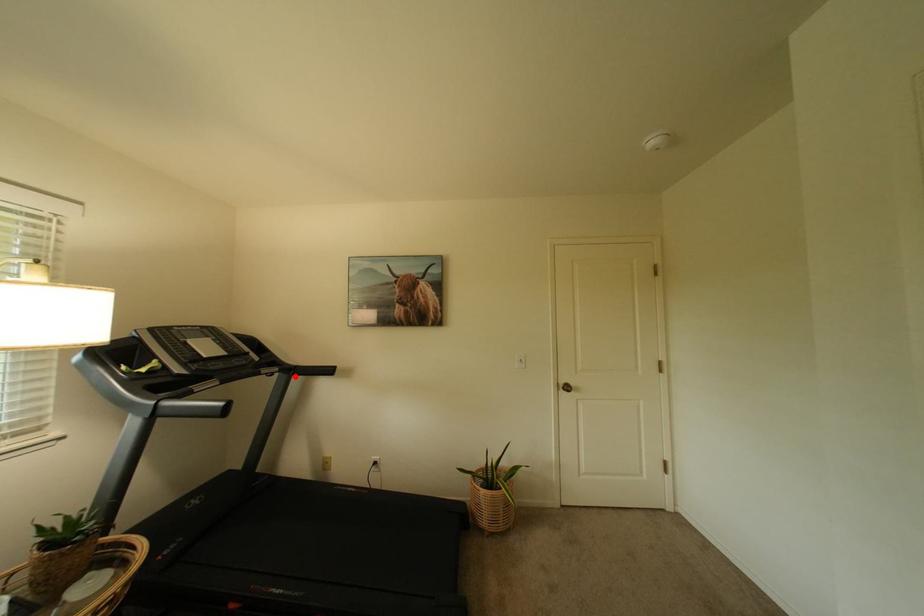
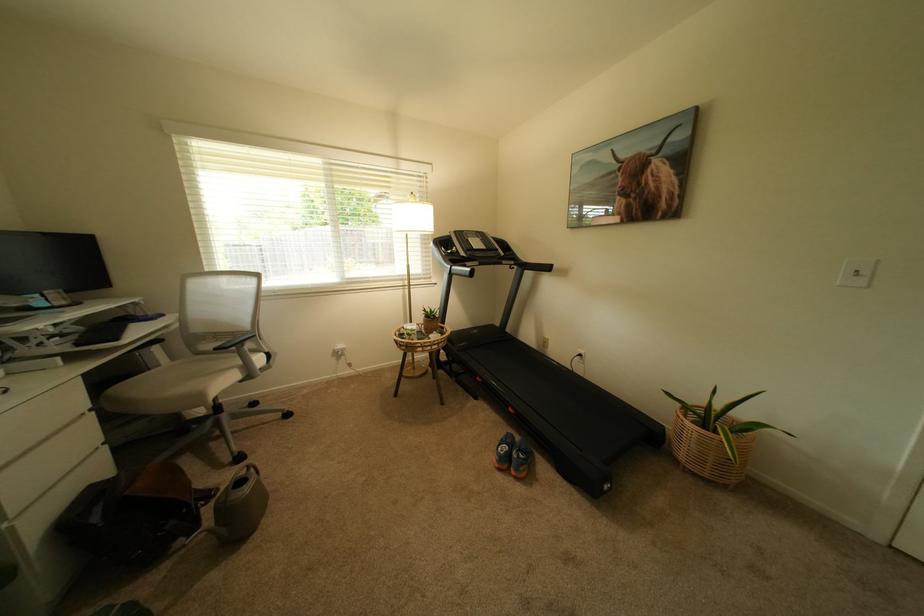
Question: I am providing you with two images of the same scene from different viewpoints. Given a red point in image1, look at the same physical point in image2. Is it:

Choices:
 (A) Closer to the viewpoint
 (B) Farther from the viewpoint

Answer: (A)